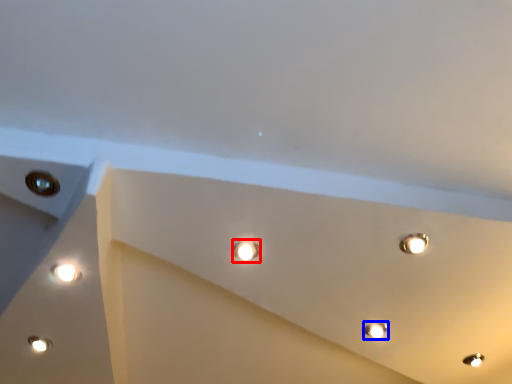
Question: Among these objects, which one is farthest to the camera, droplight (highlighted by a red box) or lamp (highlighted by a blue box)?

Choices:
 (A) droplight
 (B) lamp

Answer: (B)